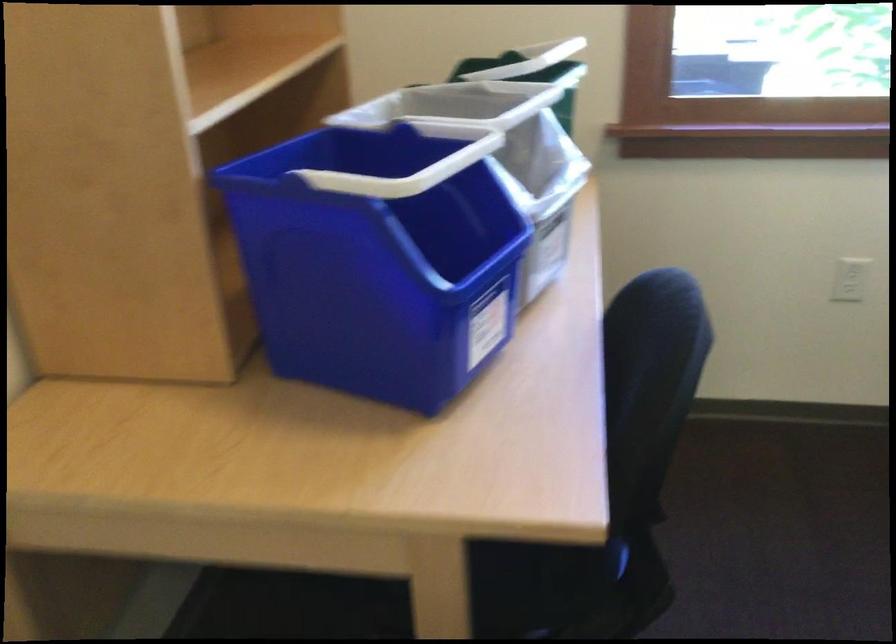
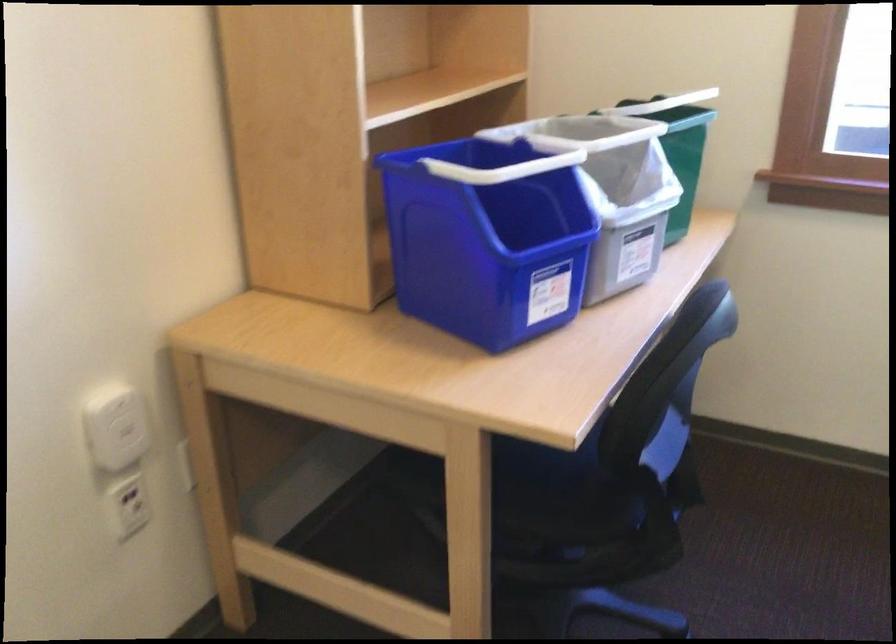
Question: The images are taken continuously from a first-person perspective. In which direction is your viewpoint rotating?

Choices:
 (A) Left
 (B) Right
 (C) Up
 (D) Down

Answer: (A)